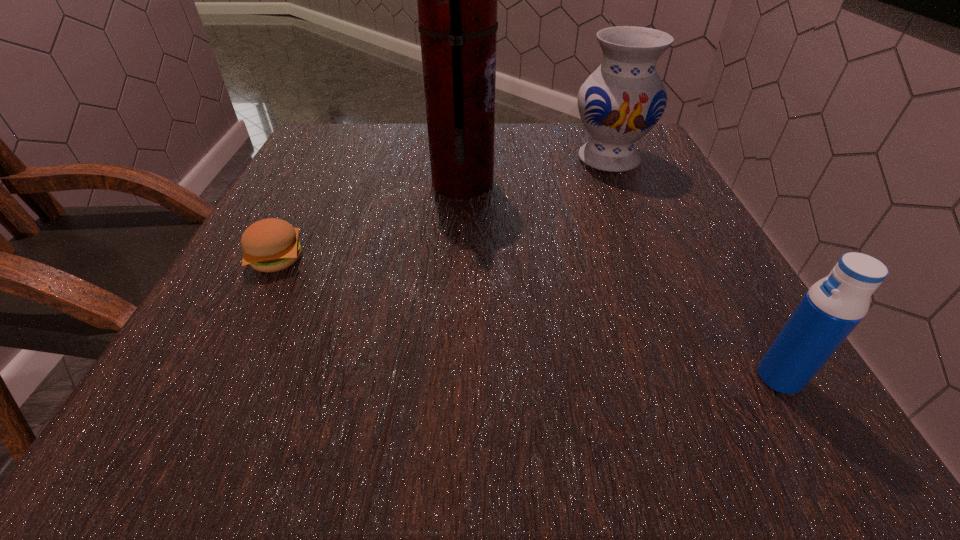
Find the location of a particular element. The image size is (960, 540). fire extinguisher is located at coordinates (457, 0).

Identify the location of the tallest object. (457, 0).

Find the location of a particular element. The height and width of the screenshot is (540, 960). the third shortest object is located at coordinates (622, 100).

Where is `water bottle`? The height and width of the screenshot is (540, 960). water bottle is located at coordinates (833, 306).

Locate an element on the screen. The height and width of the screenshot is (540, 960). the third tallest object is located at coordinates (833, 306).

Identify the location of the shortest object. Image resolution: width=960 pixels, height=540 pixels. (270, 245).

This screenshot has height=540, width=960. Identify the location of the second nearest object. (270, 245).

You are a GUI agent. You are given a task and a screenshot of the screen. Output one action in this format:
    pyautogui.click(x=<x>, y=<y>)
    Task: Click on the free space located 0.160m on the side of the second object from left to right with the handle and hose
    This screenshot has width=960, height=540.
    Given the screenshot: What is the action you would take?
    pyautogui.click(x=571, y=184)

Locate an element on the screen. This screenshot has width=960, height=540. free space located 0.090m on the back of the second tallest object is located at coordinates (594, 125).

You are a GUI agent. You are given a task and a screenshot of the screen. Output one action in this format:
    pyautogui.click(x=<x>, y=<y>)
    Task: Click on the vacant space located on the left of the water bottle
    The width and height of the screenshot is (960, 540).
    Given the screenshot: What is the action you would take?
    pyautogui.click(x=494, y=377)